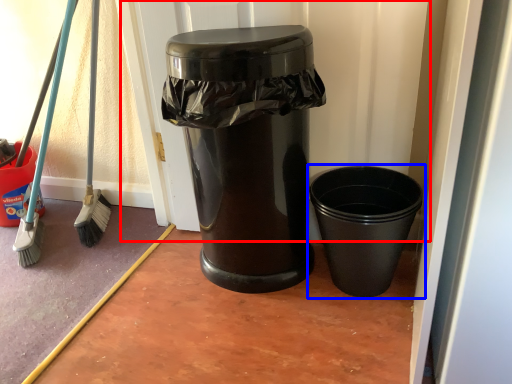
Question: Which object appears closest to the camera in this image, screen door (highlighted by a red box) or waste container (highlighted by a blue box)?

Choices:
 (A) screen door
 (B) waste container

Answer: (B)